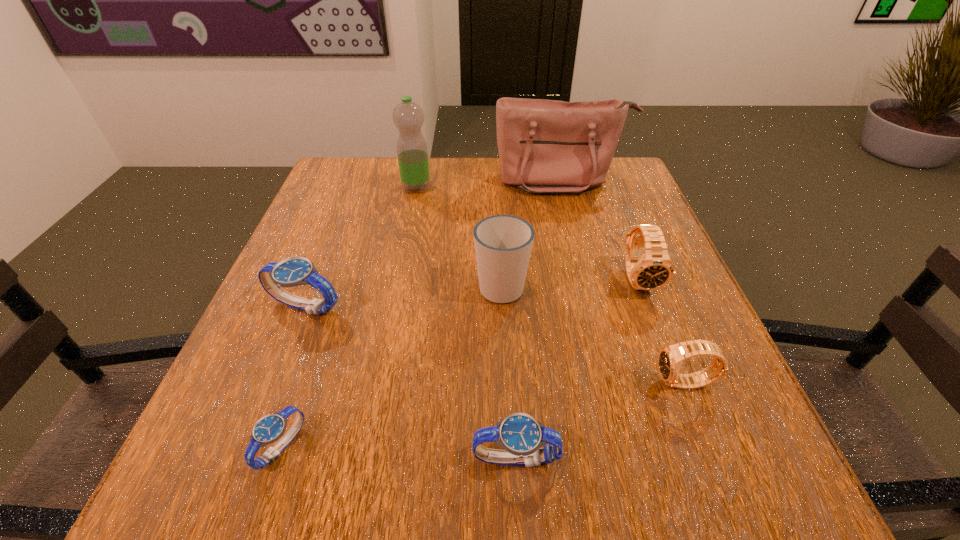
The image size is (960, 540). Identify the location of green water bottle. (408, 117).

Find the location of `the third object from left to right`. the third object from left to right is located at coordinates (408, 117).

Locate an element on the screen. This screenshot has height=540, width=960. shoulder bag is located at coordinates pyautogui.click(x=545, y=146).

This screenshot has width=960, height=540. I want to click on white cup, so click(x=503, y=243).

You are a GUI agent. You are given a task and a screenshot of the screen. Output one action in this format:
    pyautogui.click(x=<x>, y=<y>)
    Task: Click on the fifth shortest object
    The height and width of the screenshot is (540, 960).
    Given the screenshot: What is the action you would take?
    pyautogui.click(x=652, y=270)

This screenshot has height=540, width=960. Identify the location of the farther black watch. (652, 270).

Locate an element on the screen. the biggest blue watch is located at coordinates (294, 271).

The height and width of the screenshot is (540, 960). In order to click on the nearer black watch in this screenshot , I will do `click(671, 357)`.

Find the location of `the sixth farthest object`. the sixth farthest object is located at coordinates (671, 357).

At what (x,y) coordinates should I click in order to perform the action: click on the second shortest object. Please return your answer as a coordinate pair (x, y). Looking at the image, I should click on (520, 434).